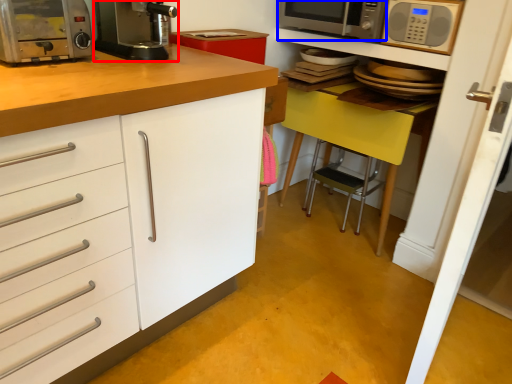
Question: Which of the following is the closest to the observer, kitchen appliance (highlighted by a red box) or microwave oven (highlighted by a blue box)?

Choices:
 (A) kitchen appliance
 (B) microwave oven

Answer: (A)